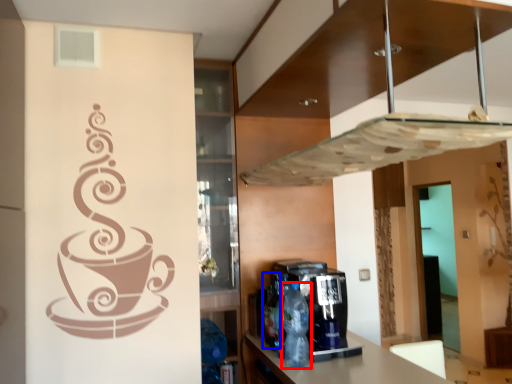
Question: Which object is closer to the camera taking this photo, bottle (highlighted by a red box) or bottle (highlighted by a blue box)?

Choices:
 (A) bottle
 (B) bottle

Answer: (A)